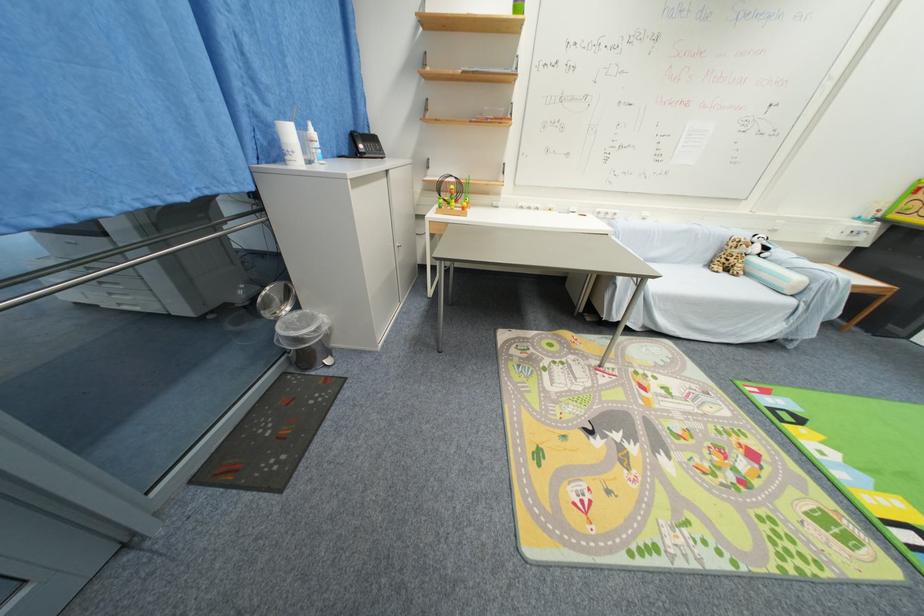
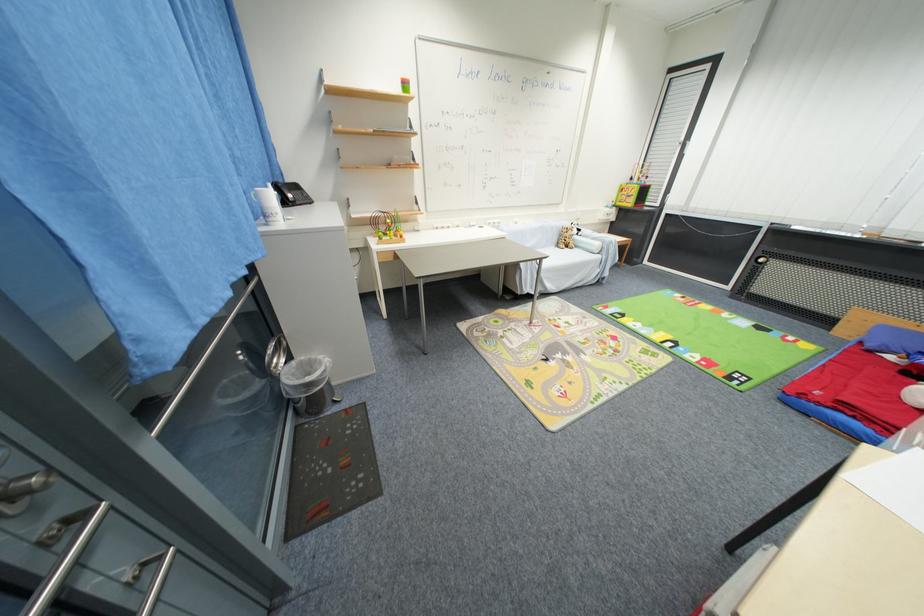
Find the pixel in the second image that matches the point at 730,276 in the first image.

(572, 251)